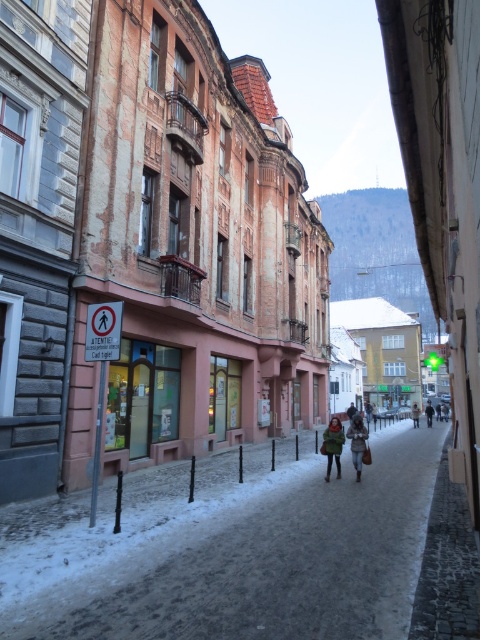
You are a photographer standing in the middle of the snowy street. You see a green fuzzy coat at center and a dark brown leather coat at center. Which coat is positioned to the right when facing the street?

The green fuzzy coat at center is positioned to the right of the dark brown leather coat at center when facing the street.

You are a passerby standing on the snowy street and see both the green fuzzy coat at center and the white fur coat at center. Which coat is positioned higher relative to the other?

The green fuzzy coat at center is located above the white fur coat at center, so it is positioned higher.